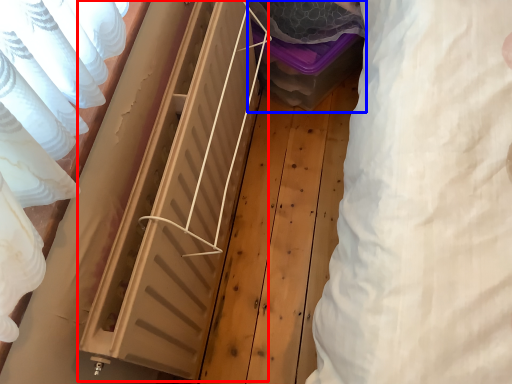
Question: Which object appears closest to the camera in this image, radiator (highlighted by a red box) or storage box (highlighted by a blue box)?

Choices:
 (A) radiator
 (B) storage box

Answer: (A)